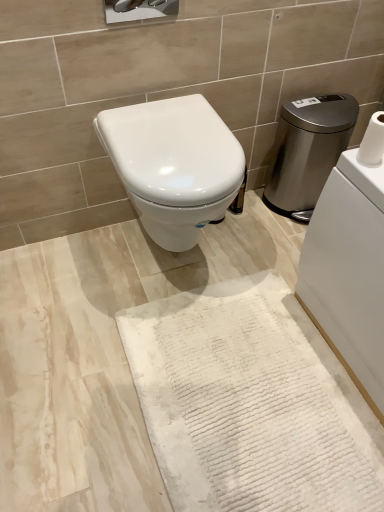
At what (x,y) coordinates should I click in order to perform the action: click on free spot behind white textured bath mat at center. Please return your answer as a coordinate pair (x, y). Looking at the image, I should click on (201, 262).